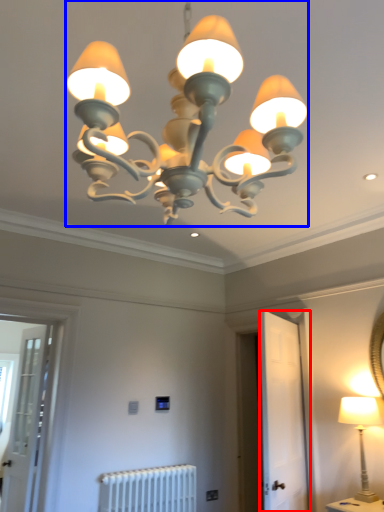
Question: Which object is closer to the camera taking this photo, screen door (highlighted by a red box) or lamp (highlighted by a blue box)?

Choices:
 (A) screen door
 (B) lamp

Answer: (B)